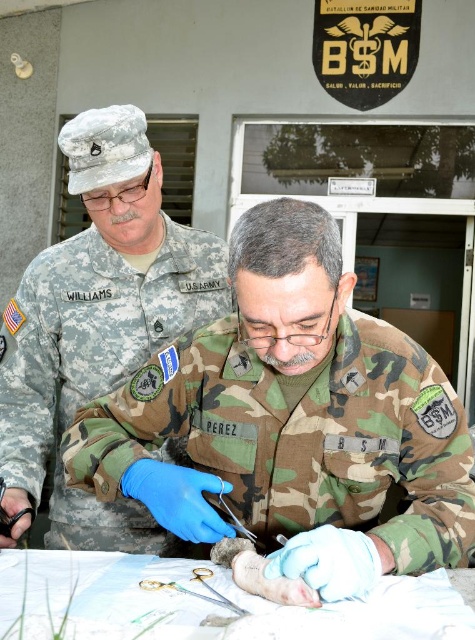
I want to click on camouflage fabric uniform at center, so click(300, 438).

What do you see at coordinates (300, 438) in the screenshot? I see `camouflage fabric uniform at center` at bounding box center [300, 438].

Identify the location of camouflage fabric uniform at center. (300, 438).

Does camouflage uniform at center have a lesser height compared to gold metallic scissors at center?

No.

Does point (47, 545) come closer to viewer compared to point (197, 579)?

No, it is behind (197, 579).

The image size is (475, 640). Identify the location of camouflage uniform at center. (97, 323).

Is camouflage fabric uniform at center to the right of gold metallic scissors at center from the viewer's perspective?

Correct, you'll find camouflage fabric uniform at center to the right of gold metallic scissors at center.

Which is more to the left, camouflage fabric uniform at center or gold metallic scissors at center?

gold metallic scissors at center is more to the left.

Between point (199, 452) and point (222, 598), which one is positioned in front?

Point (222, 598) is in front.

You are a GUI agent. You are given a task and a screenshot of the screen. Output one action in this format:
    pyautogui.click(x=<x>, y=<y>)
    Task: Click on the camouflage fabric uniform at center
    The height and width of the screenshot is (640, 475).
    Given the screenshot: What is the action you would take?
    pyautogui.click(x=300, y=438)